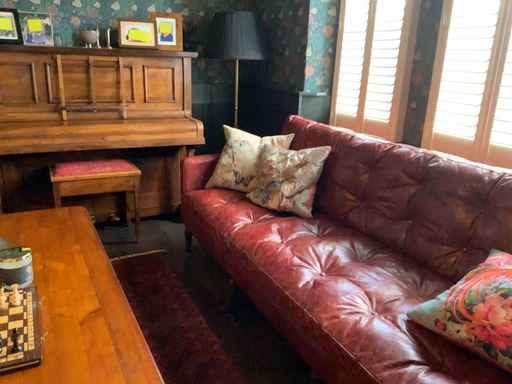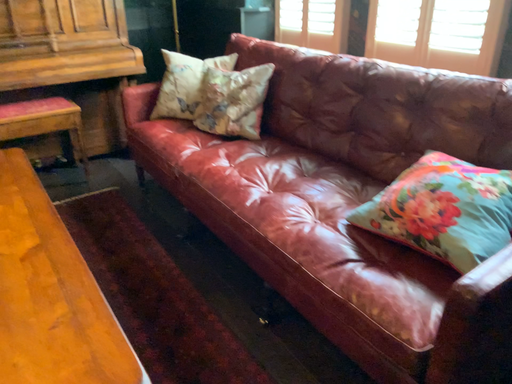
Question: Which way did the camera rotate in the video?

Choices:
 (A) rotated upward
 (B) rotated downward

Answer: (B)